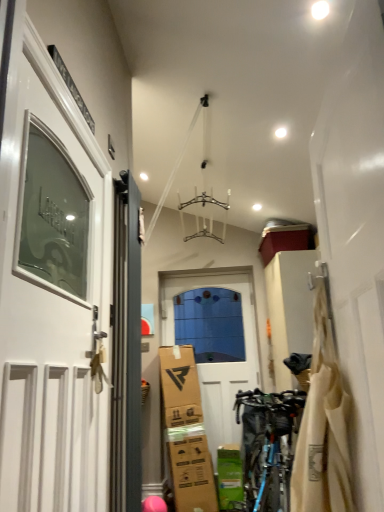
Question: Is the depth of white glossy door at left, the 3th door positioned from the right, less than that of matte gray door at left, positioned as the 2th door in front-to-back order?

Choices:
 (A) no
 (B) yes

Answer: (B)

Question: Is white glossy door at left, marked as the 3th door in a back-to-front arrangement, bigger than matte gray door at left, marked as the second door in a left-to-right arrangement?

Choices:
 (A) no
 (B) yes

Answer: (B)

Question: From a real-world perspective, is white glossy door at left, marked as the 3th door in a back-to-front arrangement, on matte gray door at left, which is counted as the second door, starting from the right?

Choices:
 (A) no
 (B) yes

Answer: (A)

Question: Does white glossy door at left, the 1th door positioned from the left, have a smaller size compared to matte gray door at left, marked as the second door in a left-to-right arrangement?

Choices:
 (A) yes
 (B) no

Answer: (B)

Question: Is white glossy door at left, the first door viewed from the front, wider than matte gray door at left, marked as the second door in a left-to-right arrangement?

Choices:
 (A) yes
 (B) no

Answer: (A)

Question: Is point (125, 456) closer or farther from the camera than point (203, 297)?

Choices:
 (A) farther
 (B) closer

Answer: (B)

Question: Would you say matte gray door at left, positioned as the 2th door in front-to-back order, is inside or outside white matte door at center, the first door positioned from the back?

Choices:
 (A) inside
 (B) outside

Answer: (B)

Question: In the image, is matte gray door at left, positioned as the 2th door in front-to-back order, positioned in front of or behind white matte door at center, placed as the third door when sorted from left to right?

Choices:
 (A) behind
 (B) front

Answer: (B)

Question: Is matte gray door at left, which is counted as the second door, starting from the right, bigger or smaller than white matte door at center, the third door viewed from the front?

Choices:
 (A) small
 (B) big

Answer: (A)

Question: Is beige fabric bag at right taller or shorter than white matte door at center, placed as the third door when sorted from left to right?

Choices:
 (A) short
 (B) tall

Answer: (A)

Question: Visually, is beige fabric bag at right positioned to the left or to the right of white matte door at center, the first door positioned from the right?

Choices:
 (A) left
 (B) right

Answer: (B)

Question: Looking at their shapes, would you say beige fabric bag at right is wider or thinner than white matte door at center, the third door viewed from the front?

Choices:
 (A) thin
 (B) wide

Answer: (B)

Question: Choose the correct answer: Is beige fabric bag at right inside white matte door at center, the third door viewed from the front, or outside it?

Choices:
 (A) outside
 (B) inside

Answer: (A)

Question: Considering their positions, is white glossy door at left, the 1th door positioned from the left, located in front of or behind beige fabric bag at right?

Choices:
 (A) front
 (B) behind

Answer: (A)

Question: From the image's perspective, is white glossy door at left, the 1th door positioned from the left, above or below beige fabric bag at right?

Choices:
 (A) above
 (B) below

Answer: (A)